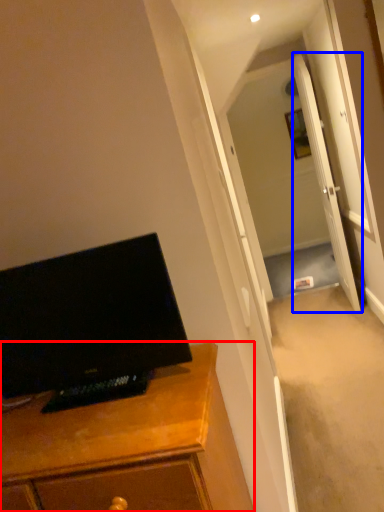
Question: Which object appears farthest to the camera in this image, cabinetry (highlighted by a red box) or door (highlighted by a blue box)?

Choices:
 (A) cabinetry
 (B) door

Answer: (B)